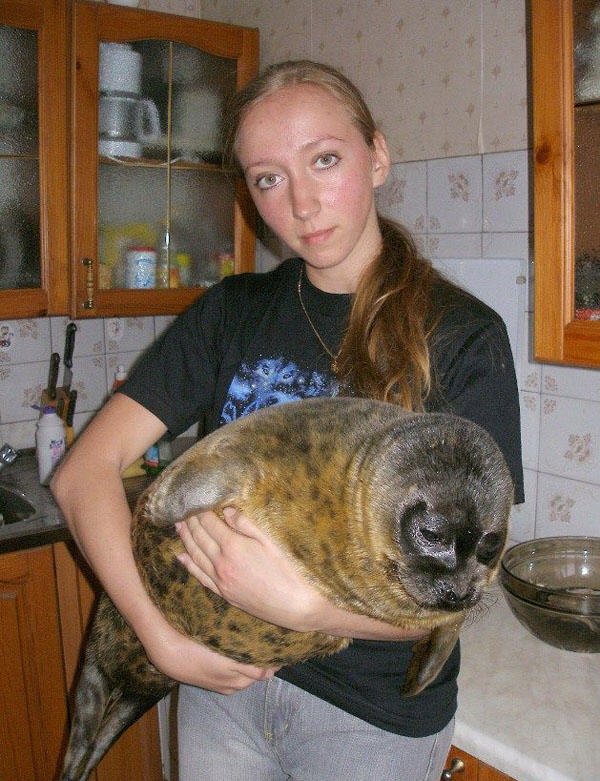
I want to click on bottle, so click(x=52, y=437), click(x=119, y=376), click(x=158, y=458).